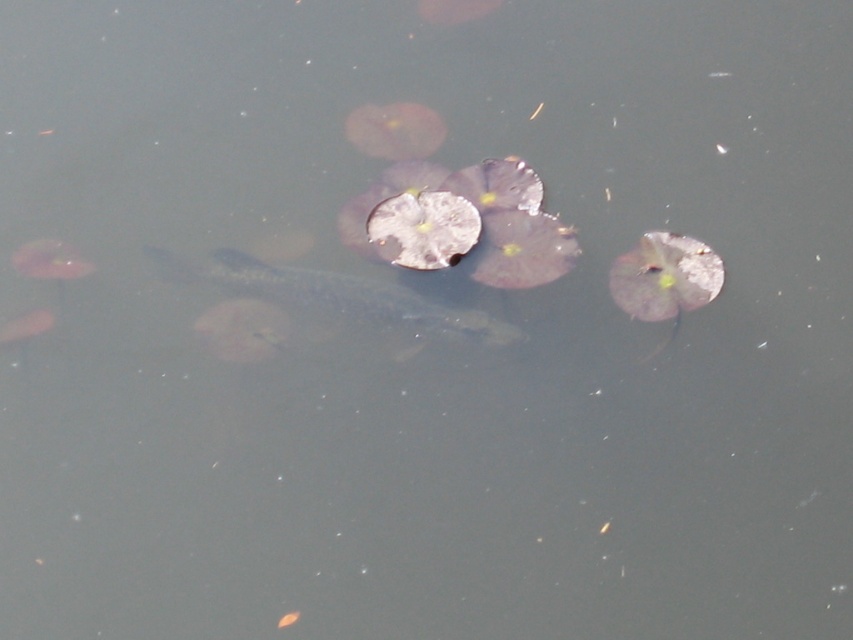
Is silvery metallic fish at center positioned in front of translucent gray fish at left?

No, it is not.

The image size is (853, 640). What do you see at coordinates (335, 296) in the screenshot? I see `silvery metallic fish at center` at bounding box center [335, 296].

Who is more distant from viewer, [349,298] or [7,342]?

Point [349,298]

At what (x,y) coordinates should I click in order to perform the action: click on silvery metallic fish at center. Please return your answer as a coordinate pair (x, y). Looking at the image, I should click on [x=335, y=296].

Is silvery metallic fish at center bigger than translucent gray fish at lower left?

Yes, silvery metallic fish at center is bigger than translucent gray fish at lower left.

Which is below, silvery metallic fish at center or translucent gray fish at lower left?

silvery metallic fish at center

Describe the element at coordinates (335, 296) in the screenshot. This screenshot has height=640, width=853. I see `silvery metallic fish at center` at that location.

This screenshot has width=853, height=640. Identify the location of silvery metallic fish at center. (335, 296).

Can you confirm if translucent gray fish at lower left is positioned to the left of translucent gray fish at left?

In fact, translucent gray fish at lower left is to the right of translucent gray fish at left.

Who is more distant from viewer, (47, 241) or (42, 326)?

Positioned behind is point (47, 241).

Is point (70, 268) behind point (38, 321)?

That is True.

What are the coordinates of `translucent gray fish at lower left` in the screenshot? It's located at (50, 260).